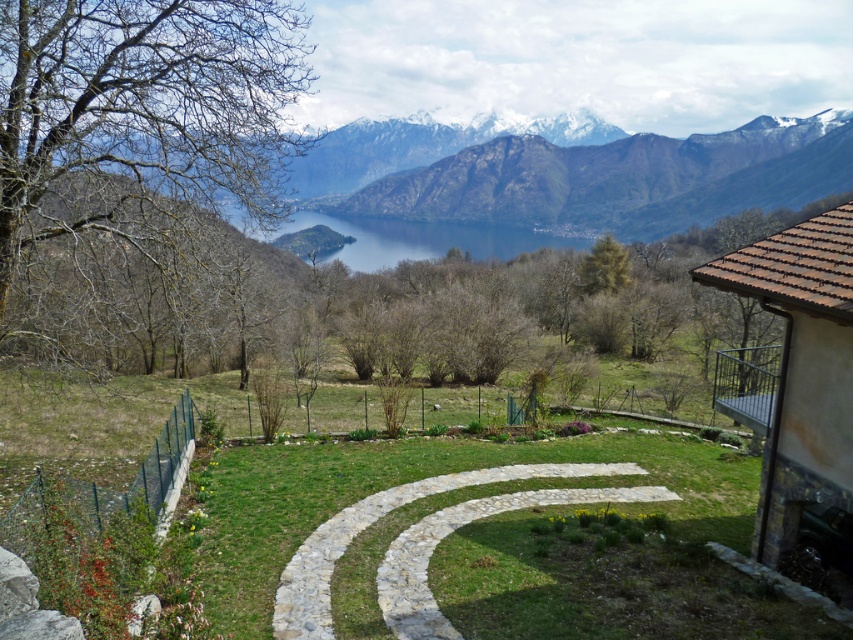
Based on the photo, which of these two, snowy rock mountain at upper center or natural stone path at center, stands shorter?

natural stone path at center is shorter.

Find the location of a particular element. snowy rock mountain at upper center is located at coordinates (624, 179).

Is point (519, 212) positioned before point (293, 625)?

No, (519, 212) is further to viewer.

This screenshot has width=853, height=640. I want to click on snowy rock mountain at upper center, so click(x=624, y=179).

Does natural stone path at center appear on the right side of greenish-blue water at center?

Yes, natural stone path at center is to the right of greenish-blue water at center.

Which is behind, point (343, 541) or point (338, 253)?

Positioned behind is point (338, 253).

This screenshot has height=640, width=853. What are the coordinates of `natural stone path at center` in the screenshot? It's located at (373, 522).

Measure the distance between point (380, 180) and camera.

Point (380, 180) is 142.30 meters away from camera.

Can you confirm if snowy rock mountain at upper center is taller than greenish-blue water at center?

Yes.

What do you see at coordinates (624, 179) in the screenshot? The width and height of the screenshot is (853, 640). I see `snowy rock mountain at upper center` at bounding box center [624, 179].

Where is `snowy rock mountain at upper center`? The height and width of the screenshot is (640, 853). snowy rock mountain at upper center is located at coordinates (624, 179).